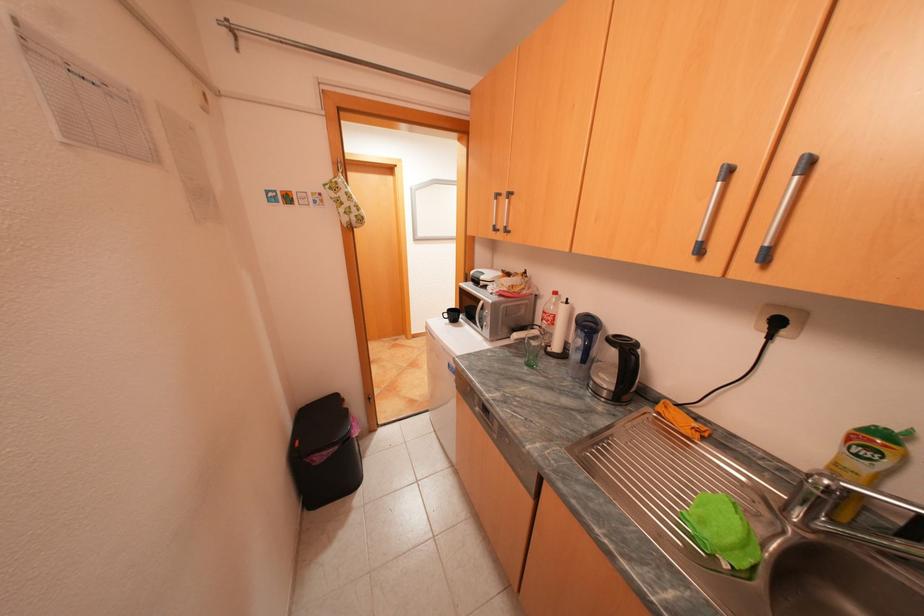
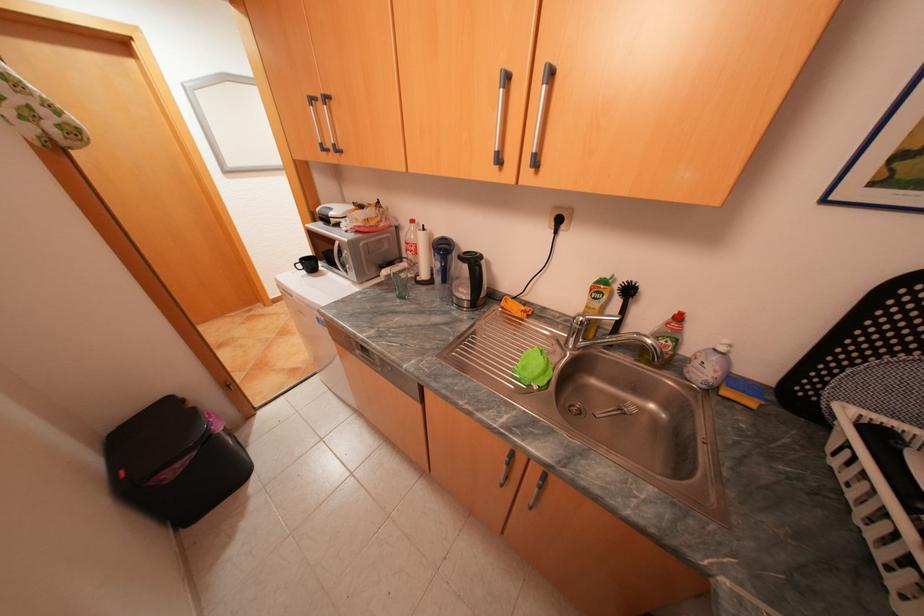
First-person continuous shooting, in which direction is the camera rotating?

The camera's rotation is toward right-down.